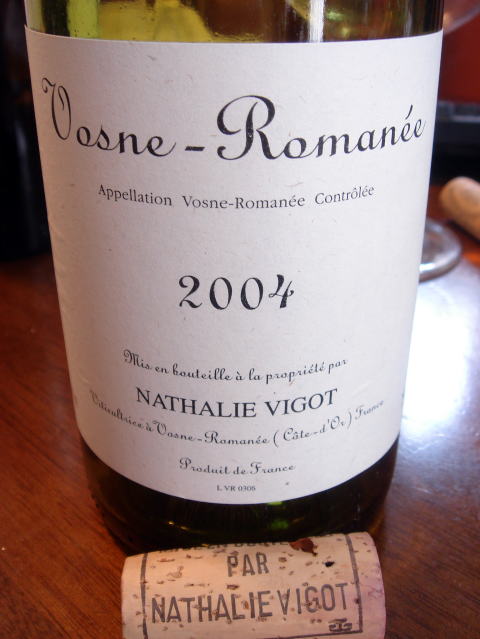
Locate an element on the screen. light brown cork is located at coordinates (196, 567).